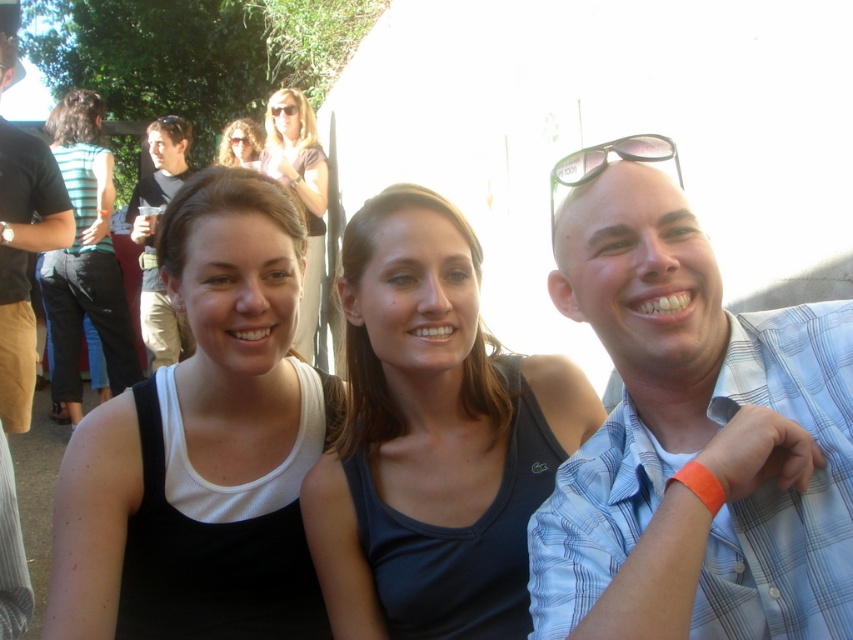
Measure the distance between matte black shirt at left and matte black sunglasses at upper center.

35.43 inches

What do you see at coordinates (154, 241) in the screenshot? I see `matte black shirt at left` at bounding box center [154, 241].

This screenshot has height=640, width=853. I want to click on matte black shirt at left, so click(154, 241).

Does point (9, 346) lie in front of point (227, 129)?

Yes, it is.

Measure the distance between black cotton t-shirt at left and matte black sunglasses at upper center.

The distance of black cotton t-shirt at left from matte black sunglasses at upper center is 3.65 meters.

Is point (62, 202) less distant than point (257, 129)?

Yes.

Where is `black cotton t-shirt at left`? black cotton t-shirt at left is located at coordinates (24, 259).

Is blue plaid shirt at center shorter than orange fabric wristband at right?

In fact, blue plaid shirt at center may be taller than orange fabric wristband at right.

Which of these two, blue plaid shirt at center or orange fabric wristband at right, stands shorter?

orange fabric wristband at right is shorter.

Find the location of a particular element. This screenshot has width=853, height=640. blue plaid shirt at center is located at coordinates (691, 435).

Locate an element on the screen. This screenshot has width=853, height=640. blue plaid shirt at center is located at coordinates (691, 435).